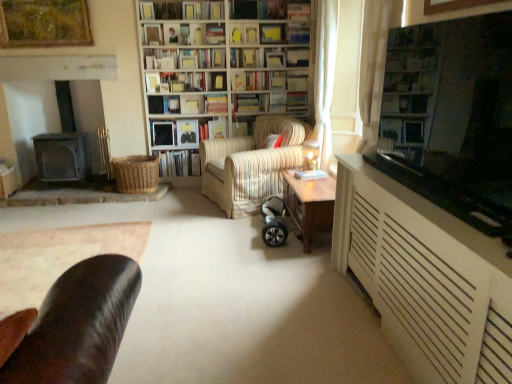
Question: Is striped fabric armchair at center inside hardcover book at center, which appears as the fourth book when ordered from the bottom?

Choices:
 (A) yes
 (B) no

Answer: (B)

Question: Does hardcover book at center, which appears as the fourth book when ordered from the bottom, lie in front of striped fabric armchair at center?

Choices:
 (A) yes
 (B) no

Answer: (B)

Question: From the image's perspective, is hardcover book at center, which appears as the fourth book when ordered from the bottom, below striped fabric armchair at center?

Choices:
 (A) yes
 (B) no

Answer: (B)

Question: From the image's perspective, is hardcover book at center, acting as the ninth book starting from the top, located above striped fabric armchair at center?

Choices:
 (A) yes
 (B) no

Answer: (A)

Question: Is hardcover book at center, acting as the ninth book starting from the top, to the left of striped fabric armchair at center from the viewer's perspective?

Choices:
 (A) yes
 (B) no

Answer: (A)

Question: From a real-world perspective, relative to hardcover book at center, marked as the eighth book in a top-to-bottom arrangement, is hardcover book at center, placed as the ninth book when sorted from bottom to top, vertically above or below?

Choices:
 (A) above
 (B) below

Answer: (A)

Question: Is hardcover book at center, placed as the ninth book when sorted from bottom to top, bigger or smaller than hardcover book at center, positioned as the fifth book in bottom-to-top order?

Choices:
 (A) small
 (B) big

Answer: (B)

Question: In terms of height, does hardcover book at center, placed as the ninth book when sorted from bottom to top, look taller or shorter compared to hardcover book at center, positioned as the fifth book in bottom-to-top order?

Choices:
 (A) tall
 (B) short

Answer: (B)

Question: Would you say hardcover book at center, which is the 4th book in top-to-bottom order, is to the left or to the right of hardcover book at center, marked as the eighth book in a top-to-bottom arrangement, in the picture?

Choices:
 (A) right
 (B) left

Answer: (A)

Question: Considering the positions of point (446, 208) and point (243, 99), is point (446, 208) closer or farther from the camera than point (243, 99)?

Choices:
 (A) farther
 (B) closer

Answer: (B)

Question: Relative to hardcover books at center, which appears as the sixth book when ordered from the bottom, is transparent glass window screen at upper right in front or behind?

Choices:
 (A) front
 (B) behind

Answer: (A)

Question: From a real-world perspective, is transparent glass window screen at upper right above or below hardcover books at center, the 7th book viewed from the top?

Choices:
 (A) below
 (B) above

Answer: (B)

Question: Looking at the image, does transparent glass window screen at upper right seem bigger or smaller compared to hardcover books at center, the 7th book viewed from the top?

Choices:
 (A) big
 (B) small

Answer: (A)

Question: Looking at their shapes, would you say hardcover book at upper center, which is the 2th book in top-to-bottom order, is wider or thinner than hardcover books at center, the 7th book viewed from the top?

Choices:
 (A) wide
 (B) thin

Answer: (B)

Question: In terms of height, does hardcover book at upper center, positioned as the 11th book in bottom-to-top order, look taller or shorter compared to hardcover books at center, the 7th book viewed from the top?

Choices:
 (A) tall
 (B) short

Answer: (B)